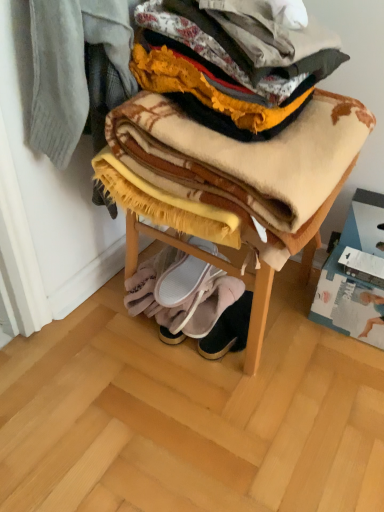
Question: Looking at the image, does leather suede booties at lower center, positioned as the 1th footwear in bottom-to-top order, seem bigger or smaller compared to soft woolen blanket at center?

Choices:
 (A) big
 (B) small

Answer: (B)

Question: In the image, is leather suede booties at lower center, the third footwear viewed from the top, positioned in front of or behind soft woolen blanket at center?

Choices:
 (A) front
 (B) behind

Answer: (B)

Question: Based on their relative distances, which object is nearer to the white suede slippers at lower center, positioned as the first footwear in top-to-bottom order?

Choices:
 (A) white fabric slipper at lower center, the second footwear viewed from the top
 (B) leather suede booties at lower center, the third footwear viewed from the top
 (C) plaid woolen blanket at center, acting as the 1th blanket starting from the top
 (D) soft yellow fleece blanket at lower center, which is the first blanket from back to front
 (E) soft woolen blanket at center

Answer: (D)

Question: Which object is the closest to the leather suede booties at lower center, the third footwear viewed from the top?

Choices:
 (A) plaid woolen blanket at center, acting as the 1th blanket starting from the top
 (B) white suede slippers at lower center, which is the 3th footwear in bottom-to-top order
 (C) white fabric slipper at lower center, which ranks as the second footwear in bottom-to-top order
 (D) soft yellow fleece blanket at lower center, the 2th blanket positioned from the front
 (E) soft woolen blanket at center

Answer: (C)